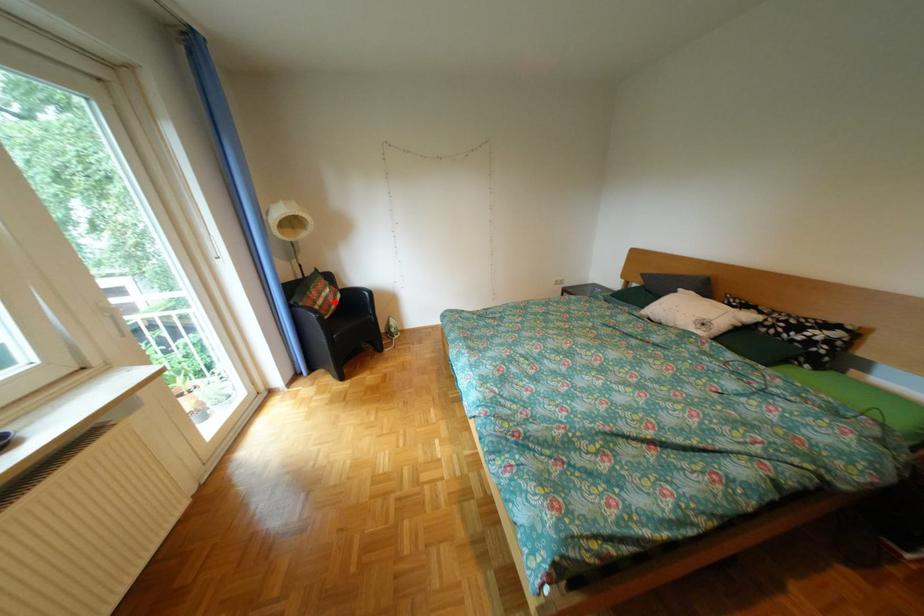
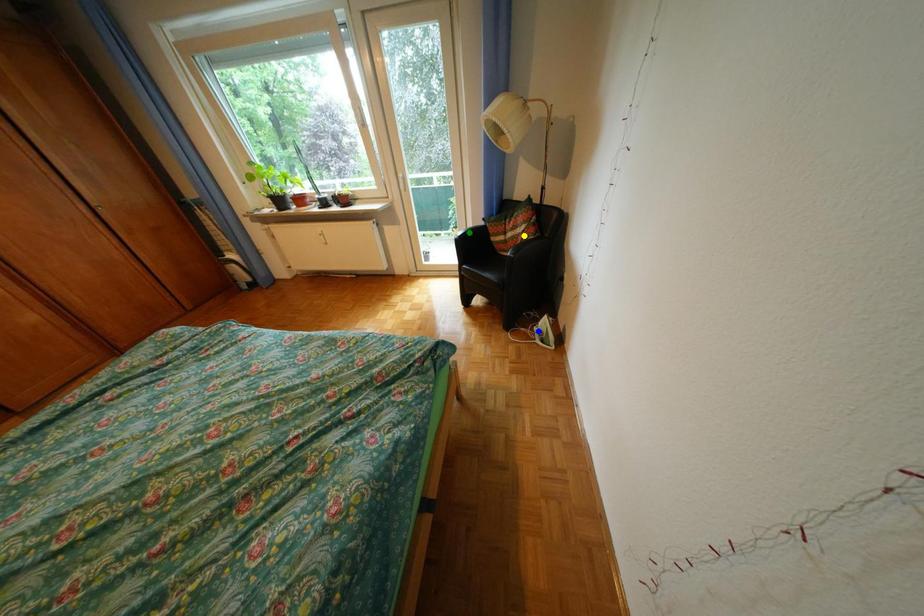
Question: I am providing you with two images of the same scene from different viewpoints. A red point is marked on the first image. You are given multiple points on the second image. In image 2, which mark is for the same physical point as the one in image 1?

Choices:
 (A) yellow point
 (B) green point
 (C) blue point

Answer: (A)